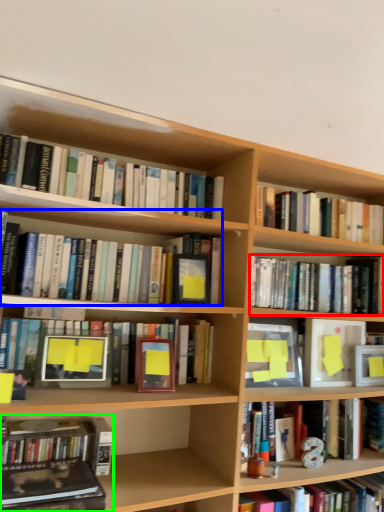
Question: Which object is the farthest from book (highlighted by a red box)? Choose among these: book (highlighted by a blue box) or book (highlighted by a green box).

Choices:
 (A) book
 (B) book

Answer: (B)